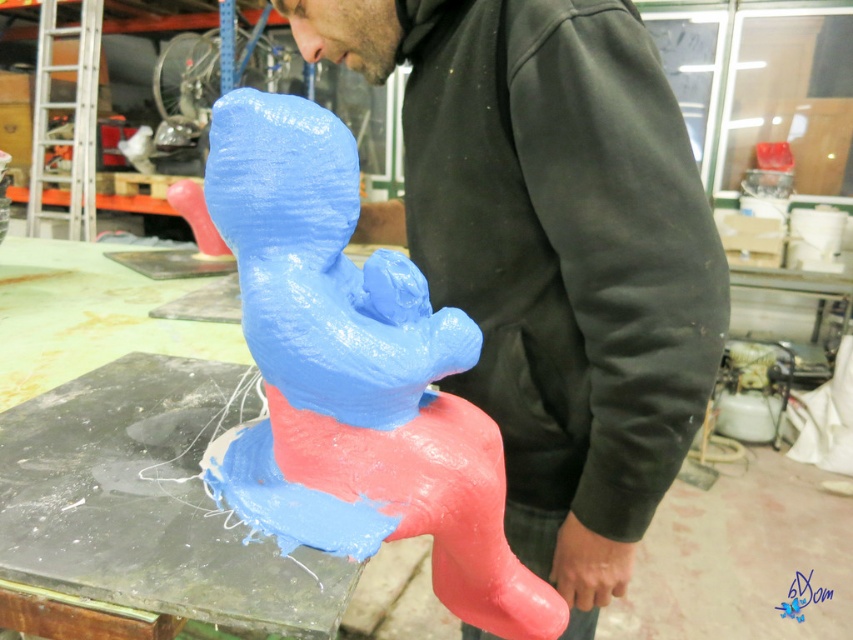
You are a delivery person who needs to place a large package on the workbench in the background. The package is wider than the matte plastic toy at center. Can you estimate whether the matte black hoodie at center would block access to the workbench?

The matte black hoodie at center might be wider than the matte plastic toy at center. Since the package is wider than the matte plastic toy at center, the matte black hoodie at center could potentially block access to the workbench if it is indeed wider. However, without exact measurements, it is uncertain. Please check the width of the matte black hoodie at center before proceeding.

You are a delivery person who needs to place a small package between the matte black hoodie at center and the matte plastic toy at center. The package is 6 inches long. Can you fit it between them?

The matte black hoodie at center and the matte plastic toy at center are 6.18 inches apart. Since the package is 6 inches long, it can fit between them as the space is slightly larger than the package.